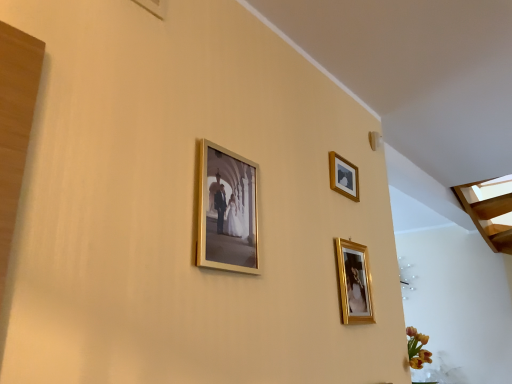
What do you see at coordinates (354, 282) in the screenshot?
I see `gold metallic picture frame at lower right, the 2th picture frame when ordered from front to back` at bounding box center [354, 282].

I want to click on wooden picture frame at upper right, positioned as the 2th picture frame in right-to-left order, so click(343, 176).

Can you see wooden picture frame at upper right, the 2th picture frame when ordered from left to right, touching gold metallic photo frame at center, arranged as the third picture frame when viewed from the back?

wooden picture frame at upper right, the 2th picture frame when ordered from left to right, and gold metallic photo frame at center, arranged as the third picture frame when viewed from the back, are clearly separated.

Is wooden picture frame at upper right, which is the first picture frame from back to front, closer to the viewer compared to gold metallic photo frame at center, the first picture frame when ordered from left to right?

No, wooden picture frame at upper right, which is the first picture frame from back to front, is behind gold metallic photo frame at center, the first picture frame when ordered from left to right.

In the scene shown: Is wooden picture frame at upper right, arranged as the third picture frame when viewed from the front, turned away from gold metallic photo frame at center, acting as the third picture frame starting from the right?

That's not correct — wooden picture frame at upper right, arranged as the third picture frame when viewed from the front, is not looking away from gold metallic photo frame at center, acting as the third picture frame starting from the right.

Can you confirm if wooden picture frame at upper right, which is the first picture frame from back to front, is positioned to the right of gold metallic photo frame at center, arranged as the third picture frame when viewed from the back?

Yes, wooden picture frame at upper right, which is the first picture frame from back to front, is to the right of gold metallic photo frame at center, arranged as the third picture frame when viewed from the back.

From a real-world perspective, which object stands above the other?

gold metallic photo frame at center, the first picture frame viewed from the front, is physically above.

Based on the photo, can you tell me how much gold metallic picture frame at lower right, positioned as the third picture frame in left-to-right order, and gold metallic photo frame at center, acting as the third picture frame starting from the right, differ in facing direction?

The facing directions of gold metallic picture frame at lower right, positioned as the third picture frame in left-to-right order, and gold metallic photo frame at center, acting as the third picture frame starting from the right, are 0.00258 degrees apart.

Consider the image. How far apart are gold metallic picture frame at lower right, positioned as the third picture frame in left-to-right order, and gold metallic photo frame at center, the first picture frame when ordered from left to right?

A distance of 22.65 inches exists between gold metallic picture frame at lower right, positioned as the third picture frame in left-to-right order, and gold metallic photo frame at center, the first picture frame when ordered from left to right.

Consider the image. Relative to gold metallic photo frame at center, acting as the third picture frame starting from the right, is gold metallic picture frame at lower right, the 2th picture frame when ordered from front to back, in front or behind?

gold metallic picture frame at lower right, the 2th picture frame when ordered from front to back, is positioned farther from the viewer than gold metallic photo frame at center, acting as the third picture frame starting from the right.

How distant is gold metallic photo frame at center, arranged as the third picture frame when viewed from the back, from wooden picture frame at upper right, which is the first picture frame from back to front?

gold metallic photo frame at center, arranged as the third picture frame when viewed from the back, is 23.98 inches from wooden picture frame at upper right, which is the first picture frame from back to front.

From the image's perspective, would you say gold metallic photo frame at center, acting as the third picture frame starting from the right, is positioned over wooden picture frame at upper right, which is the first picture frame from back to front?

No, from the image's perspective, gold metallic photo frame at center, acting as the third picture frame starting from the right, is not above wooden picture frame at upper right, which is the first picture frame from back to front.

Is gold metallic photo frame at center, the first picture frame when ordered from left to right, behind wooden picture frame at upper right, arranged as the third picture frame when viewed from the front?

No, gold metallic photo frame at center, the first picture frame when ordered from left to right, is in front of wooden picture frame at upper right, arranged as the third picture frame when viewed from the front.

Is gold metallic photo frame at center, the first picture frame viewed from the front, bigger than wooden picture frame at upper right, the 2th picture frame when ordered from left to right?

Yes.

Considering the positions of points (362, 292) and (338, 189), is point (362, 292) farther from camera compared to point (338, 189)?

No, (362, 292) is closer to viewer.

Can you confirm if gold metallic picture frame at lower right, which is the first picture frame in right-to-left order, is bigger than wooden picture frame at upper right, arranged as the third picture frame when viewed from the front?

Yes.

Identify the location of the 1st picture frame counting from the left side of the gold metallic picture frame at lower right, the 2th picture frame when ordered from front to back. (343, 176).

Based on the photo, considering the relative sizes of gold metallic photo frame at center, arranged as the third picture frame when viewed from the back, and gold metallic picture frame at lower right, which appears as the second picture frame when viewed from the back, in the image provided, is gold metallic photo frame at center, arranged as the third picture frame when viewed from the back, shorter than gold metallic picture frame at lower right, which appears as the second picture frame when viewed from the back,?

In fact, gold metallic photo frame at center, arranged as the third picture frame when viewed from the back, may be taller than gold metallic picture frame at lower right, which appears as the second picture frame when viewed from the back.

Which of these two, gold metallic photo frame at center, the first picture frame when ordered from left to right, or gold metallic picture frame at lower right, positioned as the third picture frame in left-to-right order, is wider?

gold metallic photo frame at center, the first picture frame when ordered from left to right, is wider.

From the image's perspective, would you say gold metallic photo frame at center, acting as the third picture frame starting from the right, is shown under gold metallic picture frame at lower right, positioned as the third picture frame in left-to-right order?

No, from the image's perspective, gold metallic photo frame at center, acting as the third picture frame starting from the right, is not beneath gold metallic picture frame at lower right, positioned as the third picture frame in left-to-right order.

Is point (217, 149) closer to camera compared to point (355, 249)?

Yes.

What's the angular difference between wooden picture frame at upper right, which is the first picture frame from back to front, and gold metallic picture frame at lower right, positioned as the third picture frame in left-to-right order,'s facing directions?

The angular difference between wooden picture frame at upper right, which is the first picture frame from back to front, and gold metallic picture frame at lower right, positioned as the third picture frame in left-to-right order, is 0.0013 degrees.

Is wooden picture frame at upper right, which is the first picture frame from back to front, thinner than gold metallic picture frame at lower right, which appears as the second picture frame when viewed from the back?

No.

From a real-world perspective, does wooden picture frame at upper right, which is the first picture frame from back to front, stand above gold metallic picture frame at lower right, positioned as the third picture frame in left-to-right order?

Yes, from a real-world perspective, wooden picture frame at upper right, which is the first picture frame from back to front, is over gold metallic picture frame at lower right, positioned as the third picture frame in left-to-right order

From the picture: Considering the positions of objects wooden picture frame at upper right, positioned as the 2th picture frame in right-to-left order, and gold metallic picture frame at lower right, which appears as the second picture frame when viewed from the back, in the image provided, who is in front, wooden picture frame at upper right, positioned as the 2th picture frame in right-to-left order, or gold metallic picture frame at lower right, which appears as the second picture frame when viewed from the back,?

Positioned in front is gold metallic picture frame at lower right, which appears as the second picture frame when viewed from the back.

This screenshot has width=512, height=384. In order to click on the 1st picture frame directly beneath the wooden picture frame at upper right, positioned as the 2th picture frame in right-to-left order (from a real-world perspective) in this screenshot , I will do `click(227, 211)`.

Find the location of a particular element. picture frame below the gold metallic photo frame at center, the first picture frame viewed from the front (from the image's perspective) is located at coordinates (354, 282).

Based on their spatial positions, is gold metallic photo frame at center, the first picture frame viewed from the front, or wooden picture frame at upper right, the 2th picture frame when ordered from left to right, further from gold metallic picture frame at lower right, which appears as the second picture frame when viewed from the back?

Among the two, gold metallic photo frame at center, the first picture frame viewed from the front, is located further to gold metallic picture frame at lower right, which appears as the second picture frame when viewed from the back.

Looking at the image, which one is located further to wooden picture frame at upper right, positioned as the 2th picture frame in right-to-left order, gold metallic picture frame at lower right, which is the first picture frame in right-to-left order, or gold metallic photo frame at center, the first picture frame viewed from the front?

gold metallic photo frame at center, the first picture frame viewed from the front, lies further to wooden picture frame at upper right, positioned as the 2th picture frame in right-to-left order, than the other object.

Based on the photo, from the image, which object appears to be farther from wooden picture frame at upper right, positioned as the 2th picture frame in right-to-left order, gold metallic photo frame at center, the first picture frame viewed from the front, or gold metallic picture frame at lower right, positioned as the third picture frame in left-to-right order?

Based on the image, gold metallic photo frame at center, the first picture frame viewed from the front, appears to be further to wooden picture frame at upper right, positioned as the 2th picture frame in right-to-left order.

From the image, which object appears to be nearer to gold metallic picture frame at lower right, the 2th picture frame when ordered from front to back, wooden picture frame at upper right, the 2th picture frame when ordered from left to right, or gold metallic photo frame at center, acting as the third picture frame starting from the right?

wooden picture frame at upper right, the 2th picture frame when ordered from left to right, lies closer to gold metallic picture frame at lower right, the 2th picture frame when ordered from front to back, than the other object.

Looking at the image, which one is located further to gold metallic photo frame at center, the first picture frame when ordered from left to right, wooden picture frame at upper right, the 2th picture frame when ordered from left to right, or gold metallic picture frame at lower right, positioned as the third picture frame in left-to-right order?

Based on the image, wooden picture frame at upper right, the 2th picture frame when ordered from left to right, appears to be further to gold metallic photo frame at center, the first picture frame when ordered from left to right.

Looking at the image, which one is located closer to gold metallic photo frame at center, acting as the third picture frame starting from the right, gold metallic picture frame at lower right, the 2th picture frame when ordered from front to back, or wooden picture frame at upper right, which is the first picture frame from back to front?

The object closer to gold metallic photo frame at center, acting as the third picture frame starting from the right, is gold metallic picture frame at lower right, the 2th picture frame when ordered from front to back.

Find the location of a particular element. picture frame positioned between gold metallic photo frame at center, the first picture frame viewed from the front, and wooden picture frame at upper right, arranged as the third picture frame when viewed from the front, from near to far is located at coordinates (354, 282).